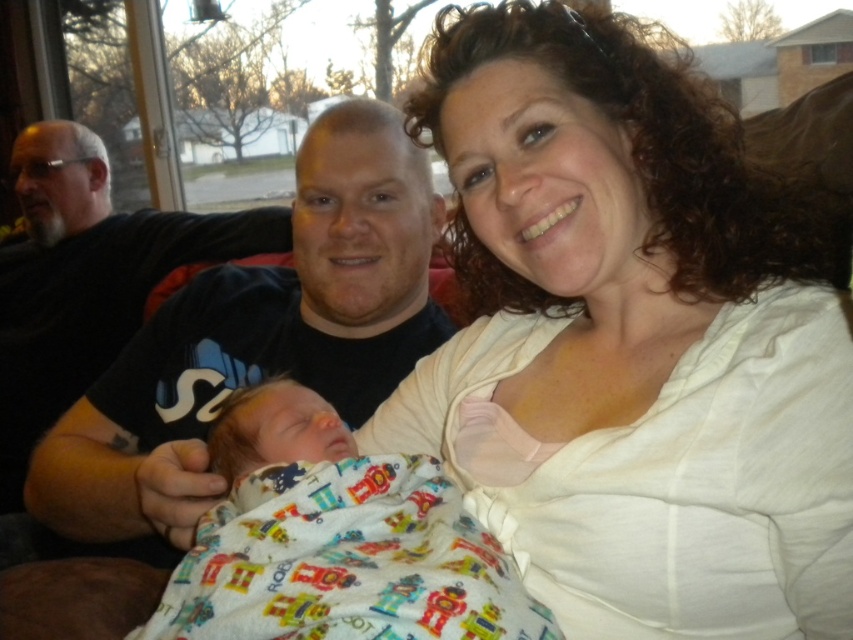
Question: Is white soft shirt at upper right wider than soft white blanket at center?

Choices:
 (A) yes
 (B) no

Answer: (A)

Question: Is white soft shirt at upper right behind soft white blanket at center?

Choices:
 (A) yes
 (B) no

Answer: (A)

Question: Which point appears closest to the camera in this image?

Choices:
 (A) (38, 476)
 (B) (511, 465)
 (C) (405, 624)

Answer: (C)

Question: Among these points, which one is farthest from the camera?

Choices:
 (A) (317, 348)
 (B) (254, 456)
 (C) (517, 253)

Answer: (A)

Question: Is white soft shirt at upper right thinner than soft white blanket at center?

Choices:
 (A) yes
 (B) no

Answer: (B)

Question: Estimate the real-world distances between objects in this image. Which object is closer to the soft white blanket at center?

Choices:
 (A) black cotton shirt at center
 (B) white soft shirt at upper right

Answer: (B)